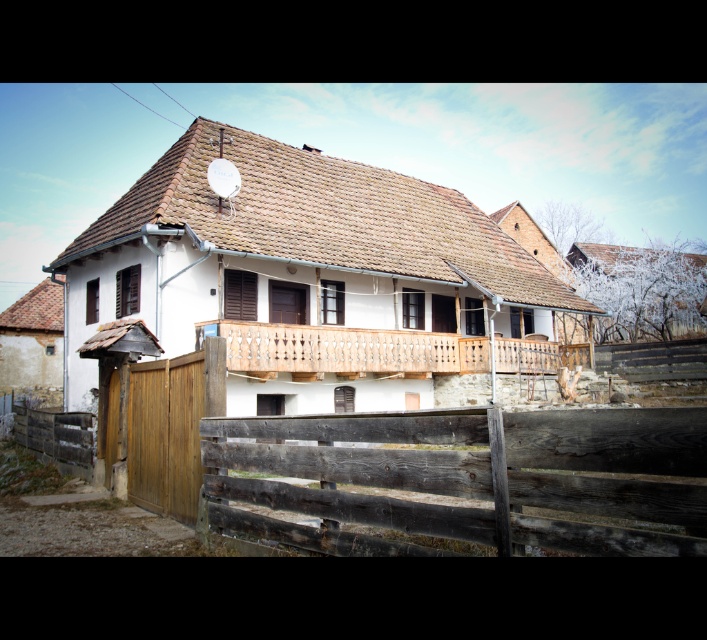
Who is positioned more to the right, weathered wood fence at lower center or wooden at center?

Positioned to the right is wooden at center.

Between weathered wood fence at lower center and wooden at center, which one appears on the left side from the viewer's perspective?

weathered wood fence at lower center is more to the left.

Identify the location of weathered wood fence at lower center. This screenshot has width=707, height=640. (469, 477).